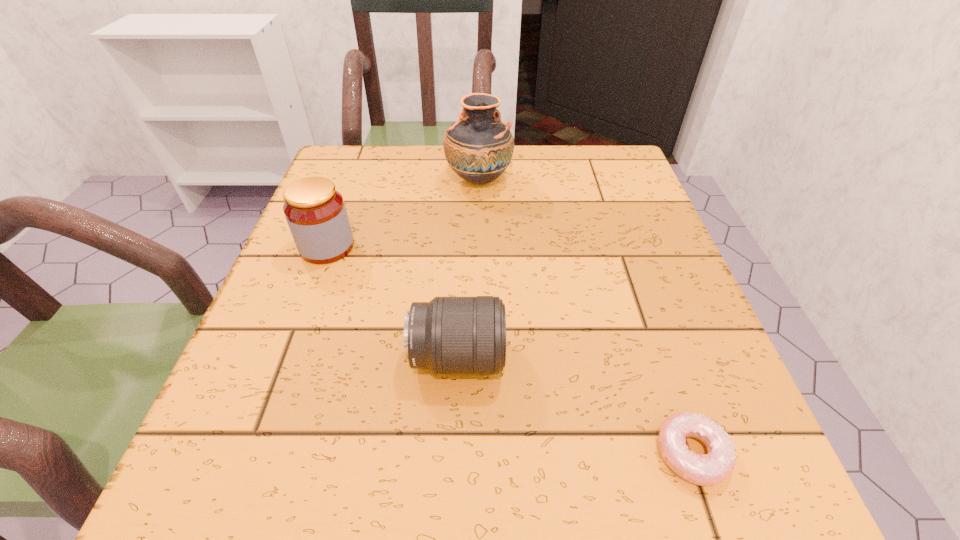
The image size is (960, 540). What are the coordinates of `free space at the far right corner of the desktop` in the screenshot? It's located at 636,185.

The width and height of the screenshot is (960, 540). Identify the location of blank space at the near right corner. (740, 476).

The width and height of the screenshot is (960, 540). Identify the location of free area in between the third farthest object and the rightmost object. (574, 406).

I want to click on vacant space in between the nearest object and the leftmost object, so click(x=509, y=350).

Identify the location of vacant area between the nearest object and the jar. Image resolution: width=960 pixels, height=540 pixels. (509, 350).

The height and width of the screenshot is (540, 960). Find the location of `blank region between the shortest object and the second farthest object`. blank region between the shortest object and the second farthest object is located at coordinates (509, 350).

In order to click on free space between the jar and the rightmost object in this screenshot , I will do `click(509, 350)`.

Image resolution: width=960 pixels, height=540 pixels. What are the coordinates of `free space between the third shortest object and the tallest object` in the screenshot? It's located at (403, 213).

Where is `unoccupied position between the farthest object and the nearest object`? unoccupied position between the farthest object and the nearest object is located at coordinates (586, 317).

This screenshot has width=960, height=540. What are the coordinates of `unoccupied area between the jar and the nearest object` in the screenshot? It's located at (509, 350).